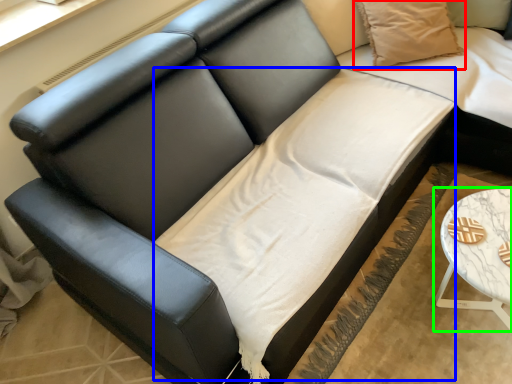
Question: Considering the real-world distances, which object is farthest from pillow (highlighted by a red box)? sheet (highlighted by a blue box) or table (highlighted by a green box)?

Choices:
 (A) sheet
 (B) table

Answer: (B)